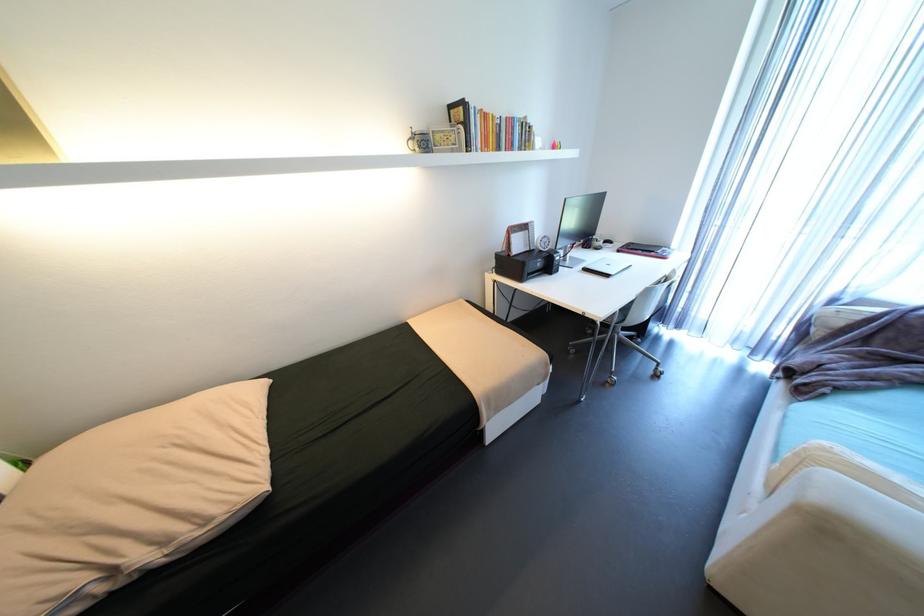
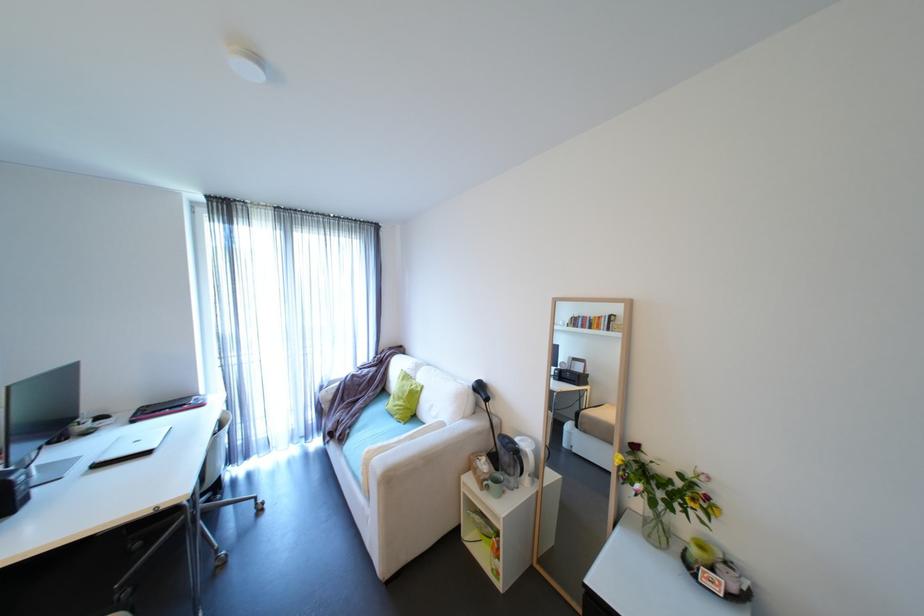
In the second image, find the point that corresponds to pixel 615 265 in the first image.

(144, 440)